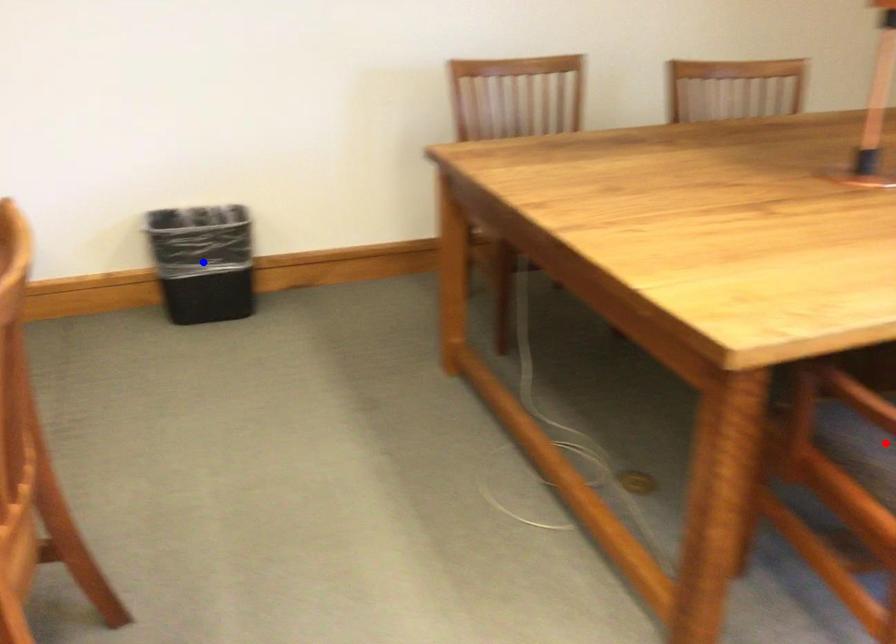
Question: Two points are marked on the image. Which point is closer to the camera?

Choices:
 (A) Blue point is closer.
 (B) Red point is closer.

Answer: (B)